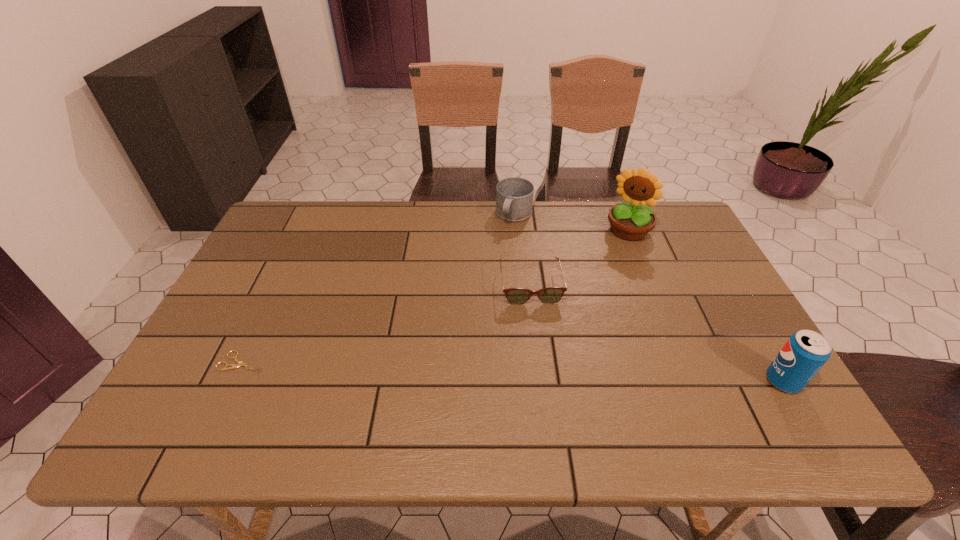
Where is `vacant spot on the desktop that is between the leftmost object and the soda can and is positioned at the front view of the second shortest object`? This screenshot has height=540, width=960. vacant spot on the desktop that is between the leftmost object and the soda can and is positioned at the front view of the second shortest object is located at coordinates (546, 373).

Where is `vacant space on the desktop that is between the leftmost object and the rightmost object and is positioned on the face of the tallest object`? This screenshot has width=960, height=540. vacant space on the desktop that is between the leftmost object and the rightmost object and is positioned on the face of the tallest object is located at coordinates (546, 373).

Image resolution: width=960 pixels, height=540 pixels. What are the coordinates of `free space on the desktop that is between the shortest object and the soda can and is positioned on the side of the third shortest object with the handle` in the screenshot? It's located at (439, 369).